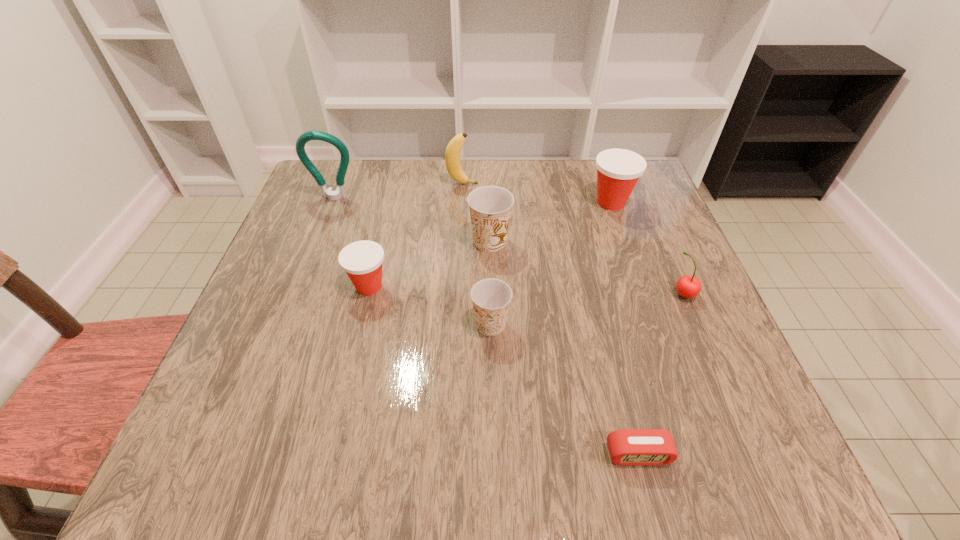
This screenshot has width=960, height=540. Identify the location of the left red-orange Dixie cup. (362, 261).

This screenshot has height=540, width=960. What are the coordinates of `the second object from left to right` in the screenshot? It's located at (362, 261).

This screenshot has width=960, height=540. I want to click on the smaller orange Dixie cup, so click(491, 297).

Where is `the nearest Dixie cup`? Image resolution: width=960 pixels, height=540 pixels. the nearest Dixie cup is located at coordinates (491, 297).

Where is `the nearest object`? the nearest object is located at coordinates (634, 447).

Locate an element on the screen. This screenshot has height=540, width=960. the shortest object is located at coordinates (634, 447).

Find the location of a particular element. The image size is (960, 540). vacant space located 0.280m at the jaws of the tallest object is located at coordinates (301, 284).

Find the location of a particular element. The width and height of the screenshot is (960, 540). vacant space located 0.240m from the stem of the banana is located at coordinates (567, 184).

Locate an element on the screen. This screenshot has width=960, height=540. free point located on the front of the farthest Dixie cup is located at coordinates (629, 255).

The image size is (960, 540). I want to click on vacant space positioned on the front of the third nearest Dixie cup, so click(492, 363).